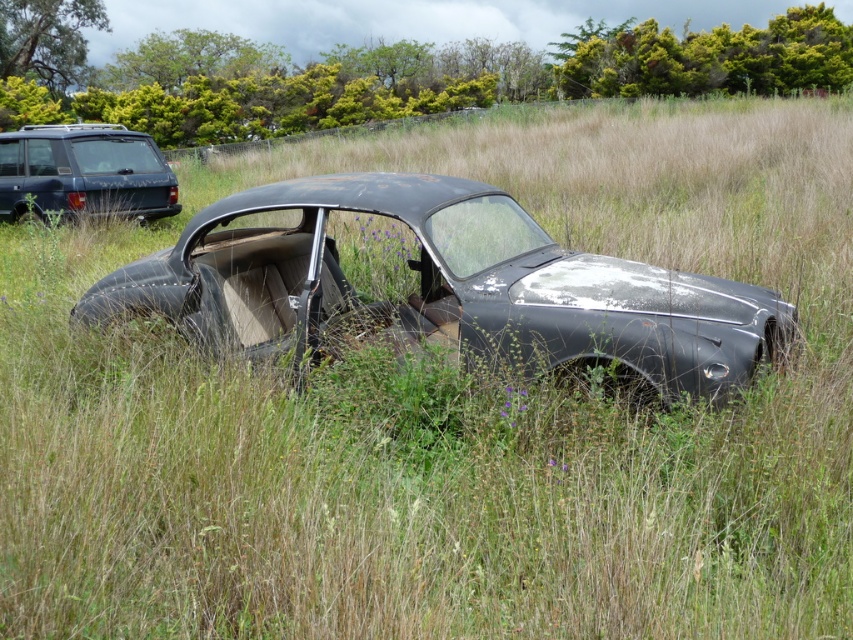
You are a photographer trying to capture both the rusty metallic car at center and the matte black suv at upper left in a single frame. Which vehicle should you focus on first to ensure both are in focus?

The rusty metallic car at center is closer to the viewer than the matte black suv at upper left. To ensure both are in focus, you should focus on the rusty metallic car at center first, as it is closer and adjusting focus from near to far will help capture both vehicles within the depth of field.

You are a delivery drone that needs to fly from the rusty metallic car at center to the matte black suv at upper left. The drone has a maximum flight distance of 5 meters. Can it reach the destination without recharging?

The distance between the rusty metallic car at center and the matte black suv at upper left is 6.63 meters, which exceeds the drone s 5 meter maximum range. Therefore, the drone cannot reach the matte black suv at upper left without recharging.